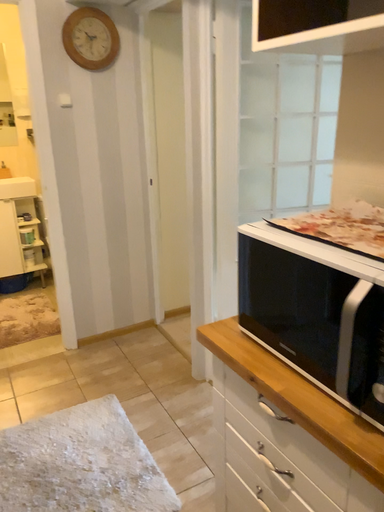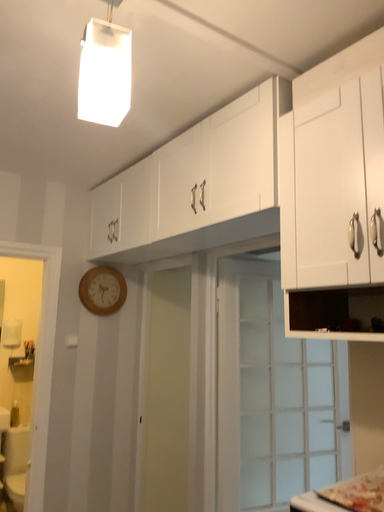
Question: How did the camera likely rotate when shooting the video?

Choices:
 (A) rotated upward
 (B) rotated downward

Answer: (A)